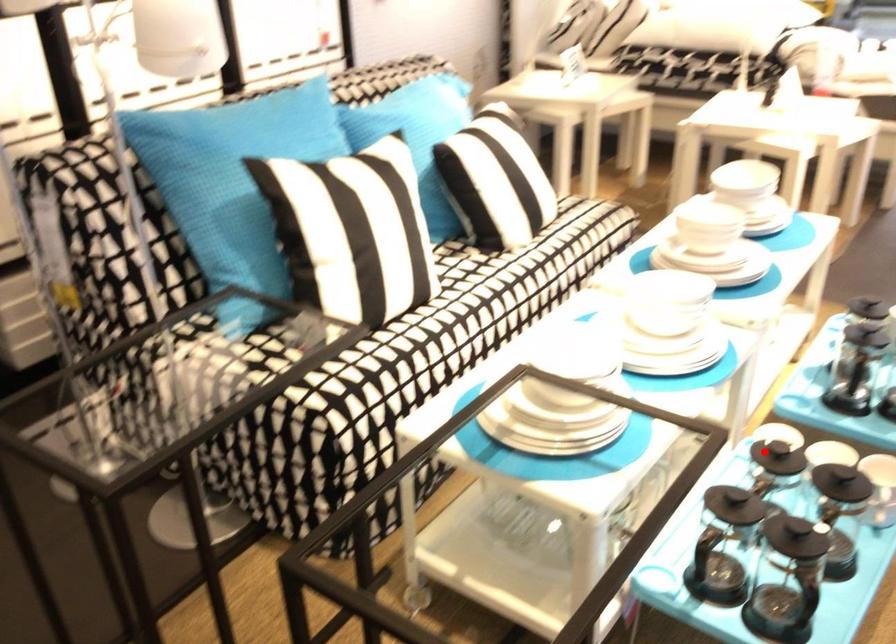
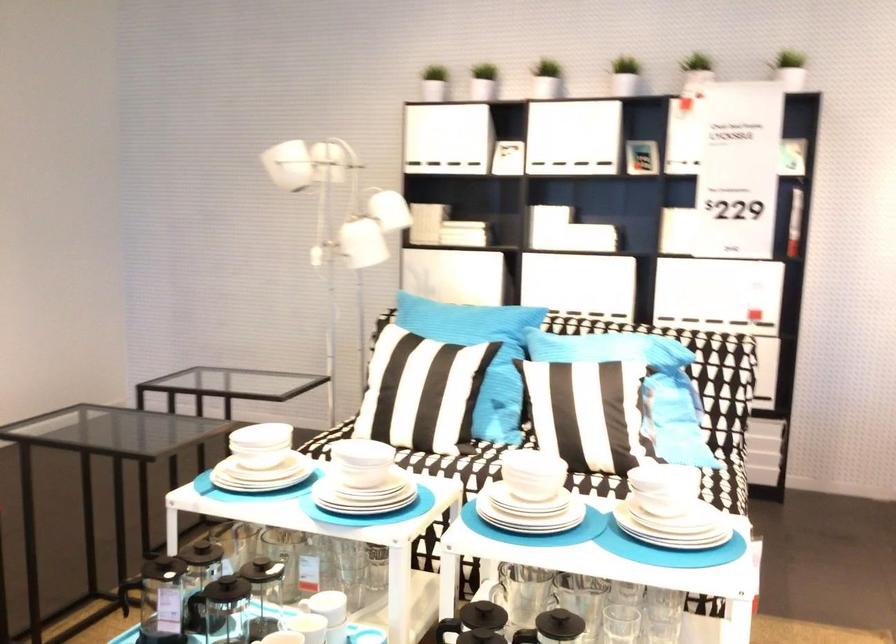
Question: I am providing you with two images of the same scene from different viewpoints. A red point is marked on the first image. Can you still see the location of the red point in image 2?

Choices:
 (A) Yes
 (B) No

Answer: (A)